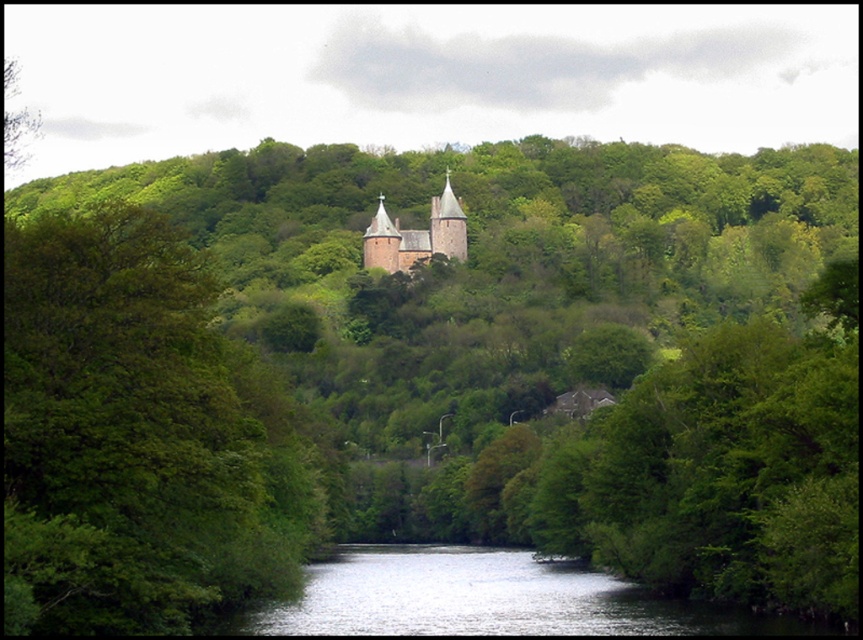
You are standing in the middle of the landscape and want to take a photo of both the green leafy tree at center and the smooth stone church at center. Which object should you focus on first to ensure both are in the frame?

You should focus on the green leafy tree at center first because it is closer to you than the smooth stone church at center, so adjusting the camera to include it will naturally include the church in the background as well.

You are standing at the point with coordinates point (17, 499) and want to walk towards the point with coordinates point (366, 266). According to the scene description, will you pass through any objects along the way?

Yes, you will pass through objects because point (17, 499) is in front of point (366, 266), meaning there are objects between them in the scene.